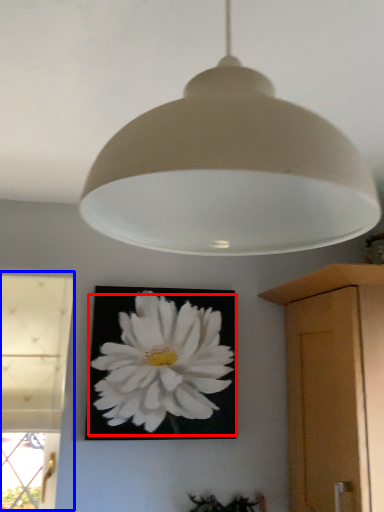
Question: Among these objects, which one is farthest to the camera, flower (highlighted by a red box) or window (highlighted by a blue box)?

Choices:
 (A) flower
 (B) window

Answer: (A)